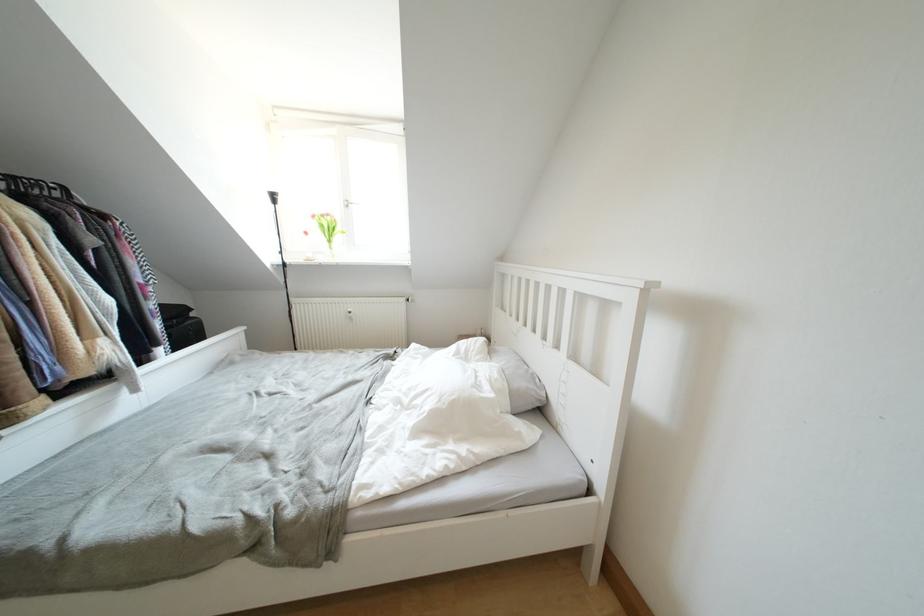
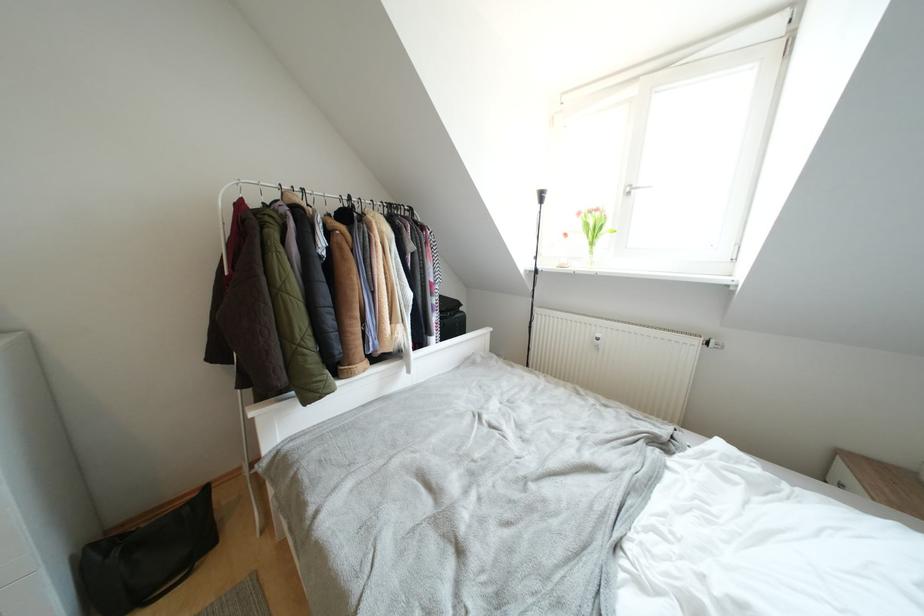
Question: The camera is either moving clockwise (left) or counter-clockwise (right) around the object. The first image is from the beginning of the video and the second image is from the end. Is the camera moving left or right when shooting the video?

Choices:
 (A) Left
 (B) Right

Answer: (B)